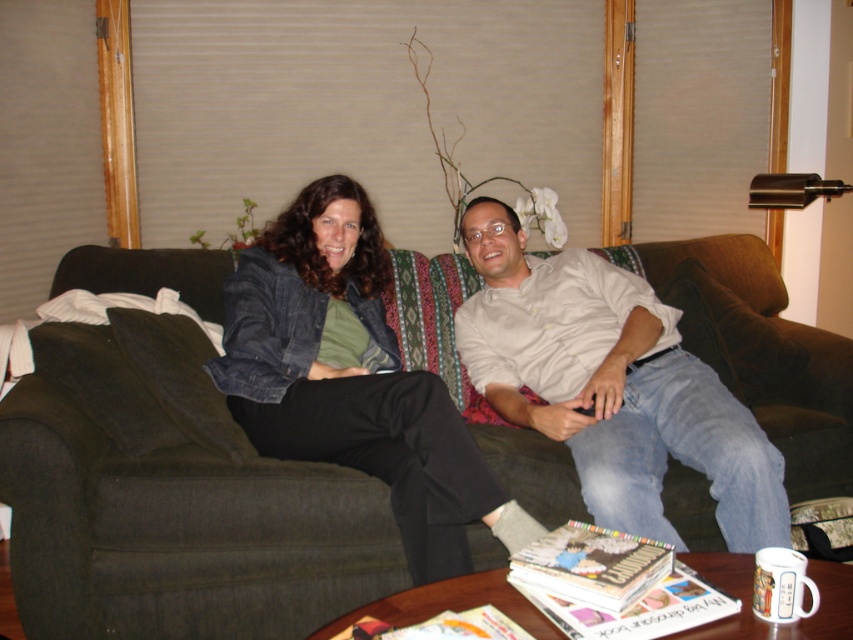
Between dark green fabric couch at center and denim jacket at center, which one appears on the right side from the viewer's perspective?

denim jacket at center

This screenshot has height=640, width=853. What do you see at coordinates (172, 506) in the screenshot?
I see `dark green fabric couch at center` at bounding box center [172, 506].

Between point (148, 356) and point (357, 464), which one is positioned in front?

Point (357, 464)

This screenshot has width=853, height=640. I want to click on dark green fabric couch at center, so click(172, 506).

What do you see at coordinates (172, 506) in the screenshot? This screenshot has height=640, width=853. I see `dark green fabric couch at center` at bounding box center [172, 506].

Is dark green fabric couch at center thinner than light beige shirt at center?

In fact, dark green fabric couch at center might be wider than light beige shirt at center.

Is point (103, 605) positioned behind point (676, 310)?

That is False.

Locate an element on the screen. dark green fabric couch at center is located at coordinates (172, 506).

Is denim jacket at center bigger than light beige shirt at center?

Yes, denim jacket at center is bigger than light beige shirt at center.

Can you confirm if denim jacket at center is positioned to the right of light beige shirt at center?

No, denim jacket at center is not to the right of light beige shirt at center.

Who is more distant from viewer, (367, 294) or (705, 372)?

The point (367, 294) is behind.

This screenshot has width=853, height=640. Identify the location of denim jacket at center. (352, 378).